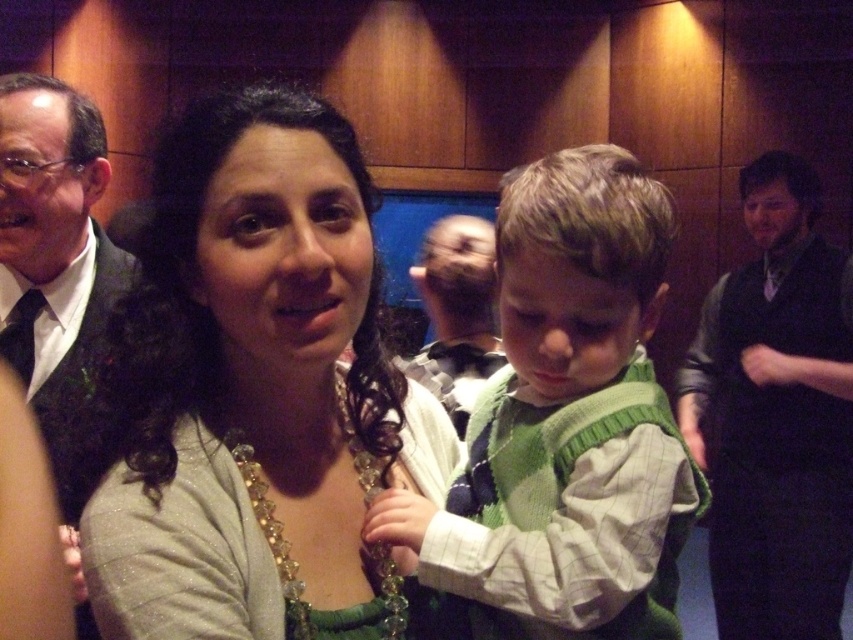
Who is lower down, black sweater at right or matte black suit at left?

Positioned lower is black sweater at right.

Identify the location of black sweater at right. (776, 416).

Can you confirm if matte black suit at left is wider than black satin tie at left?

Yes, matte black suit at left is wider than black satin tie at left.

Is point (96, 300) farther from viewer compared to point (10, 333)?

Yes.

Which is in front, point (47, 198) or point (16, 346)?

Positioned in front is point (47, 198).

What are the coordinates of `matte black suit at left` in the screenshot? It's located at (56, 268).

Which is in front, point (340, 449) or point (639, 356)?

Point (340, 449) is more forward.

Does matte gray sweater at center have a lesser height compared to green knitted sweater at center?

Indeed, matte gray sweater at center has a lesser height compared to green knitted sweater at center.

Which is in front, point (340, 456) or point (596, 371)?

Point (596, 371) is more forward.

The image size is (853, 640). Find the location of `matte gray sweater at center`. matte gray sweater at center is located at coordinates (248, 388).